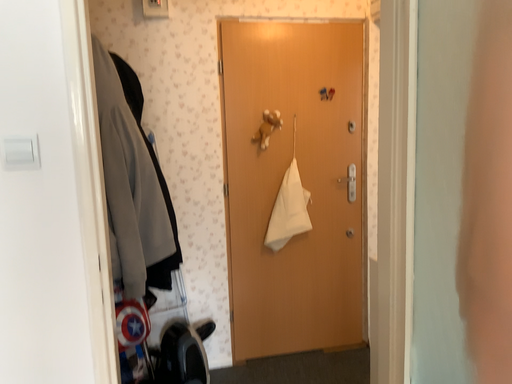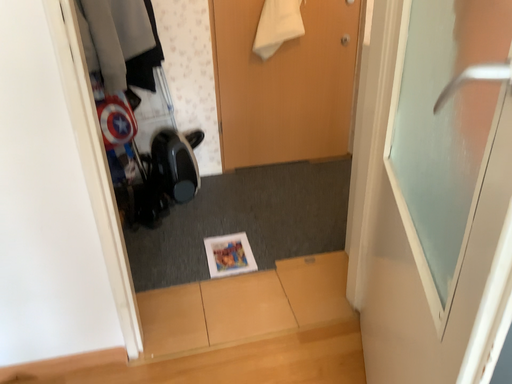
Question: Which way did the camera rotate in the video?

Choices:
 (A) rotated upward
 (B) rotated downward

Answer: (B)